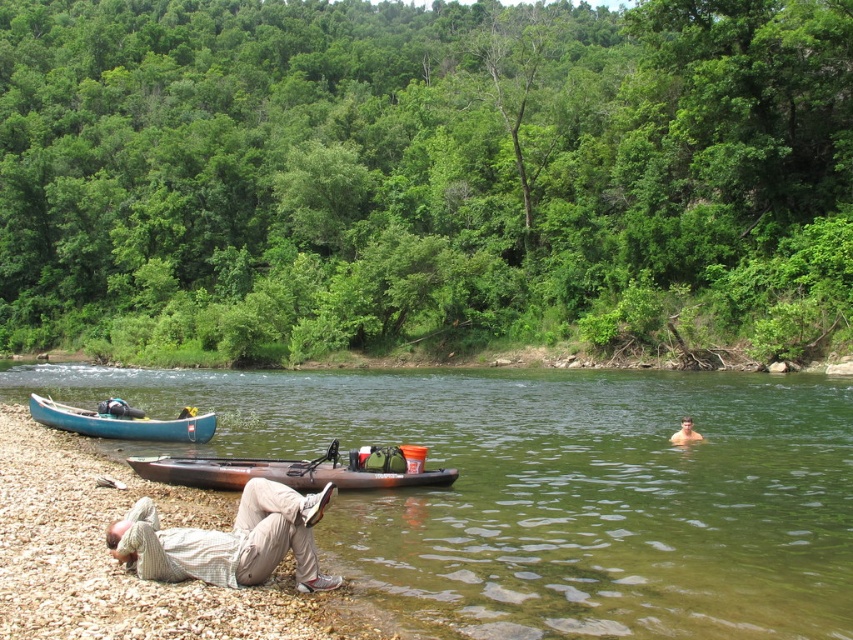
Question: Is the position of light brown cotton pants at lower left less distant than that of smooth skin at water right?

Choices:
 (A) yes
 (B) no

Answer: (A)

Question: Is light brown cotton pants at lower left above smooth skin at water right?

Choices:
 (A) no
 (B) yes

Answer: (B)

Question: Which of the following is the closest to the observer?

Choices:
 (A) (357, 554)
 (B) (94, 413)
 (C) (689, 420)

Answer: (A)

Question: Which object is closer to the camera taking this photo?

Choices:
 (A) brown matte kayak at center
 (B) light brown cotton pants at lower left

Answer: (B)

Question: Based on their relative distances, which object is nearer to the smooth skin at water right?

Choices:
 (A) light brown cotton pants at lower left
 (B) brown matte kayak at center
 (C) smooth pebbles at lower left

Answer: (B)

Question: Is light brown cotton pants at lower left positioned at the back of blue plastic canoe at lower left?

Choices:
 (A) yes
 (B) no

Answer: (B)